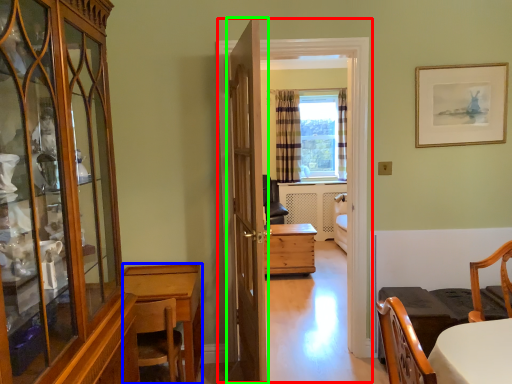
Question: Estimate the real-world distances between objects in this image. Which object is farther from corridor (highlighted by a red box), desk (highlighted by a blue box) or door (highlighted by a green box)?

Choices:
 (A) desk
 (B) door

Answer: (A)